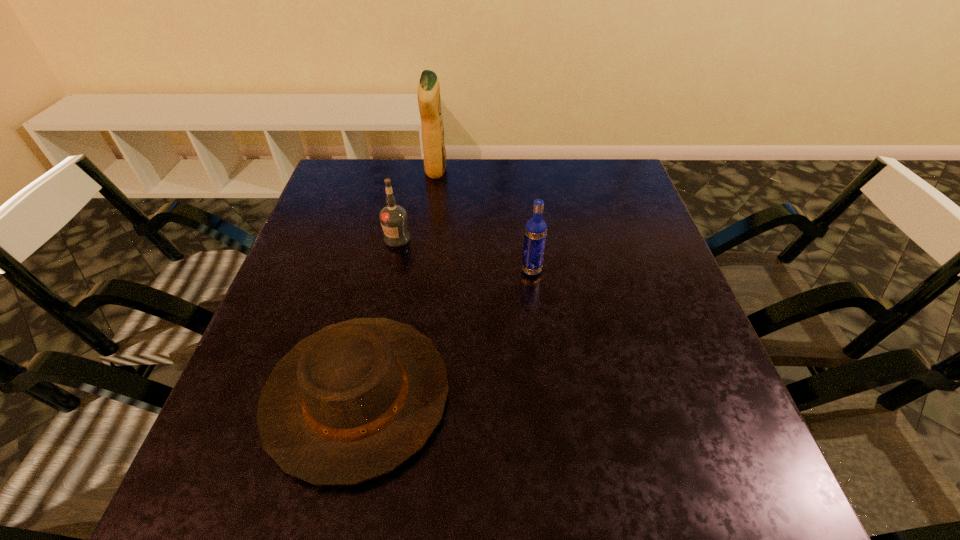
This screenshot has height=540, width=960. I want to click on free area in between the cowboy hat and the farther vodka, so click(x=377, y=317).

In order to click on vacant area that lies between the right vodka and the second farthest object in this screenshot , I will do `click(465, 254)`.

I want to click on blank region between the detergent and the right vodka, so click(x=484, y=220).

This screenshot has height=540, width=960. Identify the location of object that is the closest to the cowboy hat. (535, 230).

Locate which object is the closest to the left vodka. Please provide its 2D coordinates. Your answer should be formatted as a tuple, i.e. [(x, y)], where the tuple contains the x and y coordinates of a point satisfying the conditions above.

[(429, 101)]

Find the location of `free point that satisfies the following two spatial constraints: 1. on the front label of the rightmost object; 2. on the right side of the third nearest object`. free point that satisfies the following two spatial constraints: 1. on the front label of the rightmost object; 2. on the right side of the third nearest object is located at coordinates (391, 271).

Where is `free space that satisfies the following two spatial constraints: 1. on the label of the detergent; 2. on the front label of the left vodka`? free space that satisfies the following two spatial constraints: 1. on the label of the detergent; 2. on the front label of the left vodka is located at coordinates (427, 239).